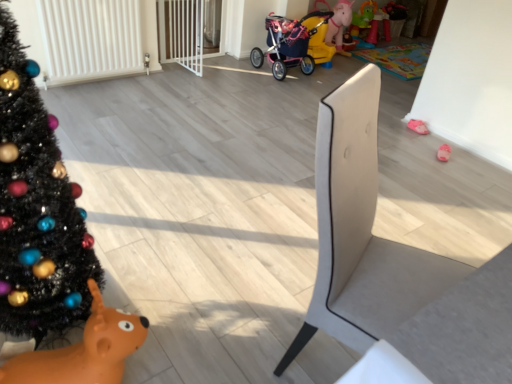
In order to click on suede-like beige chair at center-right in this screenshot , I will do `click(395, 264)`.

In order to face pink fabric baby carriage at center, should I rotate leftwards or rightwards?

It's best to rotate right around 5.349 degrees.

What do you see at coordinates (37, 208) in the screenshot? I see `black matte christmas tree at left` at bounding box center [37, 208].

This screenshot has height=384, width=512. I want to click on suede-like beige chair at center-right, so click(x=395, y=264).

In the scene shown: Is pink fabric slipper at lower right, acting as the 1th toy starting from the top, in contact with pink fabric baby carriage at center?

pink fabric slipper at lower right, acting as the 1th toy starting from the top, and pink fabric baby carriage at center are clearly separated.

Does pink fabric slipper at lower right, acting as the 1th toy starting from the top, have a smaller size compared to pink fabric baby carriage at center?

Yes, pink fabric slipper at lower right, acting as the 1th toy starting from the top, is smaller than pink fabric baby carriage at center.

Is pink fabric baby carriage at center a part of pink fabric slipper at lower right, acting as the 1th toy starting from the top?

No, pink fabric slipper at lower right, acting as the 1th toy starting from the top, does not contain pink fabric baby carriage at center.

Is point (413, 121) closer or farther from the camera than point (272, 56)?

Point (413, 121).

Is point (412, 120) less distant than point (0, 108)?

No, it is behind (0, 108).

From a real-world perspective, which object rests below the other?

From a 3D spatial view, pink fabric slipper at lower right, which is counted as the second toy, starting from the front, is below.

Is pink fabric slipper at lower right, which appears as the second toy when ordered from the bottom, beside black matte christmas tree at left?

There is a gap between pink fabric slipper at lower right, which appears as the second toy when ordered from the bottom, and black matte christmas tree at left.

Is orange rubber reindeer at lower left, which is counted as the first toy, starting from the left, taller or shorter than white matte radiator at upper left?

In the image, orange rubber reindeer at lower left, which is counted as the first toy, starting from the left, appears to be shorter than white matte radiator at upper left.

Between orange rubber reindeer at lower left, the second toy in the top-to-bottom sequence, and white matte radiator at upper left, which one has smaller size?

With smaller size is orange rubber reindeer at lower left, the second toy in the top-to-bottom sequence.

In the scene shown: Between orange rubber reindeer at lower left, which appears as the second toy when viewed from the back, and white matte radiator at upper left, which one is positioned in front?

orange rubber reindeer at lower left, which appears as the second toy when viewed from the back.

Is point (97, 333) farther from viewer compared to point (75, 40)?

No, it is in front of (75, 40).

Are suede-like beige chair at center-right and pink fabric slipper at lower right, which ranks as the 1th toy in back-to-front order, beside each other?

No, suede-like beige chair at center-right is not beside pink fabric slipper at lower right, which ranks as the 1th toy in back-to-front order.

Could you measure the distance between suede-like beige chair at center-right and pink fabric slipper at lower right, marked as the 2th toy in a left-to-right arrangement?

They are 2.33 meters apart.

Considering the relative positions of suede-like beige chair at center-right and pink fabric slipper at lower right, which is counted as the second toy, starting from the front, in the image provided, is suede-like beige chair at center-right behind pink fabric slipper at lower right, which is counted as the second toy, starting from the front,?

No, suede-like beige chair at center-right is closer to the viewer.

From the image's perspective, would you say suede-like beige chair at center-right is shown under pink fabric slipper at lower right, which ranks as the 1th toy in back-to-front order?

Yes.

Relative to pink fabric baby carriage at center, is white matte radiator at upper left in front or behind?

white matte radiator at upper left is in front of pink fabric baby carriage at center.

Which point is more forward, (49, 51) or (298, 30)?

The point (49, 51) is in front.

Is white matte radiator at upper left taller or shorter than pink fabric baby carriage at center?

white matte radiator at upper left is shorter than pink fabric baby carriage at center.

Is pink fabric slipper at lower right, which ranks as the 1th toy in back-to-front order, aimed at suede-like beige chair at center-right?

No.

Is suede-like beige chair at center-right a part of pink fabric slipper at lower right, which is counted as the second toy, starting from the front?

No, suede-like beige chair at center-right is located outside of pink fabric slipper at lower right, which is counted as the second toy, starting from the front.

Is point (418, 123) more distant than point (387, 245)?

Yes, it is behind point (387, 245).

Which is behind, point (63, 368) or point (31, 109)?

The point (63, 368) is farther from the camera.

Would you say orange rubber reindeer at lower left, which ranks as the 1th toy in front-to-back order, is inside or outside black matte christmas tree at left?

orange rubber reindeer at lower left, which ranks as the 1th toy in front-to-back order, is not enclosed by black matte christmas tree at left.

Considering the relative positions of orange rubber reindeer at lower left, the second toy in the top-to-bottom sequence, and black matte christmas tree at left in the image provided, is orange rubber reindeer at lower left, the second toy in the top-to-bottom sequence, to the left or to the right of black matte christmas tree at left?

From the image, it's evident that orange rubber reindeer at lower left, the second toy in the top-to-bottom sequence, is to the right of black matte christmas tree at left.

From the image's perspective, is orange rubber reindeer at lower left, the second toy in the top-to-bottom sequence, above or below black matte christmas tree at left?

From the image's perspective, orange rubber reindeer at lower left, the second toy in the top-to-bottom sequence, appears below black matte christmas tree at left.

Locate an element on the screen. This screenshot has width=512, height=384. toy to the right of pink fabric baby carriage at center is located at coordinates [418, 126].

Image resolution: width=512 pixels, height=384 pixels. Identify the location of the 2nd toy behind when counting from the black matte christmas tree at left. (418, 126).

Estimate the real-world distances between objects in this image. Which object is closer to black matte christmas tree at left, pink fabric baby carriage at center or orange rubber reindeer at lower left, the second toy in the top-to-bottom sequence?

Answer: orange rubber reindeer at lower left, the second toy in the top-to-bottom sequence.

Estimate the real-world distances between objects in this image. Which object is further from pink fabric slipper at lower right, the 1th toy positioned from the right, orange rubber reindeer at lower left, the second toy in the top-to-bottom sequence, or pink fabric baby carriage at center?

orange rubber reindeer at lower left, the second toy in the top-to-bottom sequence.

When comparing their distances from suede-like beige chair at center-right, does pink fabric baby carriage at center or white matte radiator at upper left seem closer?

Among the two, white matte radiator at upper left is located nearer to suede-like beige chair at center-right.

Estimate the real-world distances between objects in this image. Which object is further from pink fabric slipper at lower right, which appears as the second toy when ordered from the bottom, black matte christmas tree at left or pink fabric baby carriage at center?

black matte christmas tree at left.

Based on their spatial positions, is pink fabric baby carriage at center or suede-like beige chair at center-right further from orange rubber reindeer at lower left, the 2th toy when ordered from right to left?

The object further to orange rubber reindeer at lower left, the 2th toy when ordered from right to left, is pink fabric baby carriage at center.

In the scene shown: Considering their positions, is pink fabric slipper at lower right, acting as the 1th toy starting from the top, positioned further to pink fabric baby carriage at center than suede-like beige chair at center-right?

The object further to pink fabric baby carriage at center is suede-like beige chair at center-right.

Which object lies further to the anchor point pink fabric slipper at lower right, which appears as the second toy when ordered from the bottom, white matte radiator at upper left or pink fabric baby carriage at center?

Among the two, white matte radiator at upper left is located further to pink fabric slipper at lower right, which appears as the second toy when ordered from the bottom.

From the picture: Based on their spatial positions, is suede-like beige chair at center-right or white matte radiator at upper left further from pink fabric baby carriage at center?

suede-like beige chair at center-right.

Locate an element on the screen. This screenshot has width=512, height=384. toy between suede-like beige chair at center-right and pink fabric slipper at lower right, acting as the 1th toy starting from the top, along the z-axis is located at coordinates (84, 351).

Find the location of a particular element. toy located between black matte christmas tree at left and suede-like beige chair at center-right in the left-right direction is located at coordinates (84, 351).

In order to click on baby carriage between white matte radiator at upper left and pink fabric slipper at lower right, the 1th toy positioned from the right, in the horizontal direction in this screenshot , I will do `click(292, 44)`.

Identify the location of radiator positioned between black matte christmas tree at left and pink fabric slipper at lower right, acting as the 1th toy starting from the top, from near to far. (90, 39).